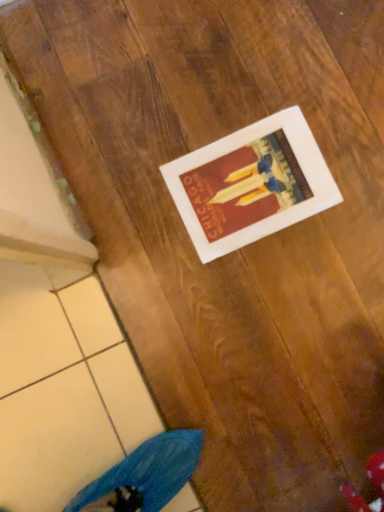
Find the location of a particular element. free space to the right of white matte picture frame at center is located at coordinates (335, 108).